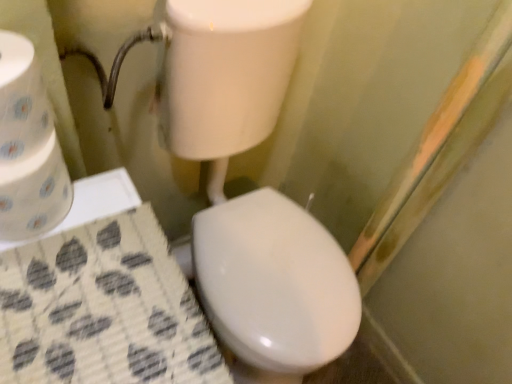
Measure the distance between point (12, 85) and camera.

The depth of point (12, 85) is 15.71 inches.

Describe the element at coordinates (21, 99) in the screenshot. I see `white paper towel at left, positioned as the 1th toilet paper in top-to-bottom order` at that location.

Identify the location of white paper towel at left, positioned as the 1th toilet paper in top-to-bottom order. This screenshot has width=512, height=384. (21, 99).

What do you see at coordinates (28, 147) in the screenshot? I see `white paper towel at left, which ranks as the 1th toilet paper in bottom-to-top order` at bounding box center [28, 147].

Locate an element on the screen. The height and width of the screenshot is (384, 512). white paper towel at left, which ranks as the 1th toilet paper in bottom-to-top order is located at coordinates (28, 147).

Where is `white paper towel at left, positioned as the 1th toilet paper in top-to-bottom order`? white paper towel at left, positioned as the 1th toilet paper in top-to-bottom order is located at coordinates (21, 99).

Considering the relative positions of white paper towel at left, the second toilet paper in the top-to-bottom sequence, and white paper towel at left, positioned as the 1th toilet paper in top-to-bottom order, in the image provided, is white paper towel at left, the second toilet paper in the top-to-bottom sequence, to the right of white paper towel at left, positioned as the 1th toilet paper in top-to-bottom order, from the viewer's perspective?

Incorrect, white paper towel at left, the second toilet paper in the top-to-bottom sequence, is not on the right side of white paper towel at left, positioned as the 1th toilet paper in top-to-bottom order.

Is the depth of white paper towel at left, the second toilet paper in the top-to-bottom sequence, less than that of white paper towel at left, positioned as the 1th toilet paper in top-to-bottom order?

No, white paper towel at left, the second toilet paper in the top-to-bottom sequence, is behind white paper towel at left, positioned as the 1th toilet paper in top-to-bottom order.

Is point (3, 43) closer to camera compared to point (36, 97)?

Yes, it is in front of point (36, 97).

From the image's perspective, is white paper towel at left, which ranks as the 1th toilet paper in bottom-to-top order, above or below white paper towel at left, positioned as the 1th toilet paper in top-to-bottom order?

From the image's perspective, white paper towel at left, which ranks as the 1th toilet paper in bottom-to-top order, appears below white paper towel at left, positioned as the 1th toilet paper in top-to-bottom order.

From a real-world perspective, is white paper towel at left, the second toilet paper in the top-to-bottom sequence, above or below white paper towel at left, positioned as the 1th toilet paper in top-to-bottom order?

Result: white paper towel at left, the second toilet paper in the top-to-bottom sequence, is situated lower than white paper towel at left, positioned as the 1th toilet paper in top-to-bottom order, in the real world.

Considering the relative sizes of white paper towel at left, the second toilet paper in the top-to-bottom sequence, and white paper towel at left, positioned as the 2th toilet paper in bottom-to-top order, in the image provided, is white paper towel at left, the second toilet paper in the top-to-bottom sequence, thinner than white paper towel at left, positioned as the 2th toilet paper in bottom-to-top order,?

No, white paper towel at left, the second toilet paper in the top-to-bottom sequence, is not thinner than white paper towel at left, positioned as the 2th toilet paper in bottom-to-top order.

Considering the sizes of objects white paper towel at left, the second toilet paper in the top-to-bottom sequence, and white paper towel at left, positioned as the 1th toilet paper in top-to-bottom order, in the image provided, who is shorter, white paper towel at left, the second toilet paper in the top-to-bottom sequence, or white paper towel at left, positioned as the 1th toilet paper in top-to-bottom order,?

With less height is white paper towel at left, positioned as the 1th toilet paper in top-to-bottom order.

In terms of size, does white paper towel at left, which ranks as the 1th toilet paper in bottom-to-top order, appear bigger or smaller than white paper towel at left, positioned as the 1th toilet paper in top-to-bottom order?

In the image, white paper towel at left, which ranks as the 1th toilet paper in bottom-to-top order, appears to be larger than white paper towel at left, positioned as the 1th toilet paper in top-to-bottom order.

Can white paper towel at left, positioned as the 2th toilet paper in bottom-to-top order, be found inside white paper towel at left, the second toilet paper in the top-to-bottom sequence?

No, white paper towel at left, positioned as the 2th toilet paper in bottom-to-top order, is located outside of white paper towel at left, the second toilet paper in the top-to-bottom sequence.

Are white paper towel at left, the second toilet paper in the top-to-bottom sequence, and white paper towel at left, positioned as the 1th toilet paper in top-to-bottom order, far apart?

That's not correct — white paper towel at left, the second toilet paper in the top-to-bottom sequence, is a little close to white paper towel at left, positioned as the 1th toilet paper in top-to-bottom order.

Is white paper towel at left, which ranks as the 1th toilet paper in bottom-to-top order, looking in the opposite direction of white paper towel at left, positioned as the 2th toilet paper in bottom-to-top order?

No.

How different are the orientations of white paper towel at left, the second toilet paper in the top-to-bottom sequence, and white paper towel at left, positioned as the 2th toilet paper in bottom-to-top order, in degrees?

0.000776 degrees.

The height and width of the screenshot is (384, 512). I want to click on toilet paper that appears below the white paper towel at left, positioned as the 1th toilet paper in top-to-bottom order (from a real-world perspective), so [x=28, y=147].

In the image, is white paper towel at left, positioned as the 1th toilet paper in top-to-bottom order, on the left side or the right side of white paper towel at left, which ranks as the 1th toilet paper in bottom-to-top order?

white paper towel at left, positioned as the 1th toilet paper in top-to-bottom order, is to the right of white paper towel at left, which ranks as the 1th toilet paper in bottom-to-top order.

In the scene shown: Is white paper towel at left, positioned as the 2th toilet paper in bottom-to-top order, positioned in front of white paper towel at left, the second toilet paper in the top-to-bottom sequence?

Yes, the depth of white paper towel at left, positioned as the 2th toilet paper in bottom-to-top order, is less than that of white paper towel at left, the second toilet paper in the top-to-bottom sequence.

Which is further, (x=27, y=67) or (x=33, y=99)?

Point (x=33, y=99)

From the image's perspective, is white paper towel at left, positioned as the 1th toilet paper in top-to-bottom order, above or below white paper towel at left, which ranks as the 1th toilet paper in bottom-to-top order?

Based on their image positions, white paper towel at left, positioned as the 1th toilet paper in top-to-bottom order, is located above white paper towel at left, which ranks as the 1th toilet paper in bottom-to-top order.

From a real-world perspective, is white paper towel at left, positioned as the 2th toilet paper in bottom-to-top order, positioned over white paper towel at left, which ranks as the 1th toilet paper in bottom-to-top order, based on gravity?

Indeed, from a real-world perspective, white paper towel at left, positioned as the 2th toilet paper in bottom-to-top order, stands above white paper towel at left, which ranks as the 1th toilet paper in bottom-to-top order.

In terms of width, does white paper towel at left, positioned as the 2th toilet paper in bottom-to-top order, look wider or thinner when compared to white paper towel at left, the second toilet paper in the top-to-bottom sequence?

Considering their sizes, white paper towel at left, positioned as the 2th toilet paper in bottom-to-top order, looks slimmer than white paper towel at left, the second toilet paper in the top-to-bottom sequence.

Considering the sizes of white paper towel at left, positioned as the 1th toilet paper in top-to-bottom order, and white paper towel at left, the second toilet paper in the top-to-bottom sequence, in the image, is white paper towel at left, positioned as the 1th toilet paper in top-to-bottom order, taller or shorter than white paper towel at left, the second toilet paper in the top-to-bottom sequence,?

white paper towel at left, positioned as the 1th toilet paper in top-to-bottom order, is shorter than white paper towel at left, the second toilet paper in the top-to-bottom sequence.

Who is smaller, white paper towel at left, positioned as the 1th toilet paper in top-to-bottom order, or white paper towel at left, which ranks as the 1th toilet paper in bottom-to-top order?

white paper towel at left, positioned as the 1th toilet paper in top-to-bottom order, is smaller.

Is white paper towel at left, positioned as the 1th toilet paper in top-to-bottom order, surrounding white paper towel at left, which ranks as the 1th toilet paper in bottom-to-top order?

Definitely not — white paper towel at left, which ranks as the 1th toilet paper in bottom-to-top order, is not inside white paper towel at left, positioned as the 1th toilet paper in top-to-bottom order.

Is white paper towel at left, positioned as the 1th toilet paper in top-to-bottom order, with white paper towel at left, the second toilet paper in the top-to-bottom sequence?

Yes, white paper towel at left, positioned as the 1th toilet paper in top-to-bottom order, is in contact with white paper towel at left, the second toilet paper in the top-to-bottom sequence.

Does white paper towel at left, positioned as the 2th toilet paper in bottom-to-top order, turn towards white paper towel at left, which ranks as the 1th toilet paper in bottom-to-top order?

No.

Can you tell me how much white paper towel at left, positioned as the 2th toilet paper in bottom-to-top order, and white paper towel at left, the second toilet paper in the top-to-bottom sequence, differ in facing direction?

There is a 0.000776-degree angle between the facing directions of white paper towel at left, positioned as the 2th toilet paper in bottom-to-top order, and white paper towel at left, the second toilet paper in the top-to-bottom sequence.

This screenshot has width=512, height=384. Identify the location of toilet paper below the white paper towel at left, positioned as the 1th toilet paper in top-to-bottom order (from the image's perspective). (28, 147).

Locate an element on the screen. The image size is (512, 384). toilet paper above the white paper towel at left, the second toilet paper in the top-to-bottom sequence (from a real-world perspective) is located at coordinates (21, 99).

Locate an element on the screen. The image size is (512, 384). toilet paper lying above the white paper towel at left, which ranks as the 1th toilet paper in bottom-to-top order (from the image's perspective) is located at coordinates (21, 99).